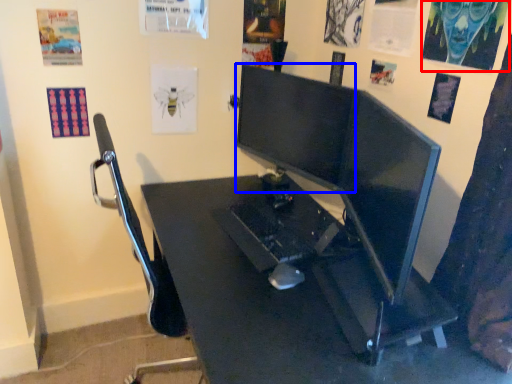
Question: Which of the following is the farthest to the observer, poster page (highlighted by a red box) or computer monitor (highlighted by a blue box)?

Choices:
 (A) poster page
 (B) computer monitor

Answer: (B)